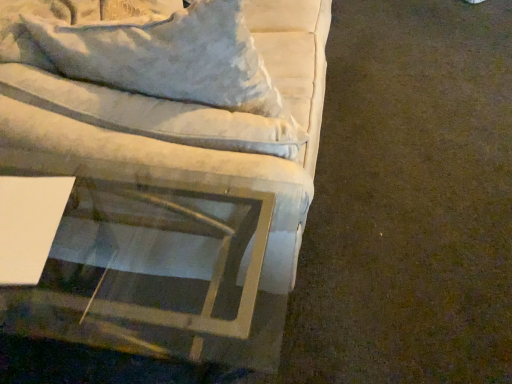
Question: Is velvet white couch at upper left bigger or smaller than clear glass table at lower left?

Choices:
 (A) big
 (B) small

Answer: (B)

Question: Is velvet white couch at upper left inside the boundaries of clear glass table at lower left, or outside?

Choices:
 (A) outside
 (B) inside

Answer: (A)

Question: Looking at their shapes, would you say velvet white couch at upper left is wider or thinner than clear glass table at lower left?

Choices:
 (A) wide
 (B) thin

Answer: (B)

Question: Based on their positions, is clear glass table at lower left located to the left or right of velvet white couch at upper left?

Choices:
 (A) left
 (B) right

Answer: (A)

Question: From the image's perspective, relative to velvet white couch at upper left, is clear glass table at lower left above or below?

Choices:
 (A) above
 (B) below

Answer: (B)

Question: Which is correct: clear glass table at lower left is inside velvet white couch at upper left, or outside of it?

Choices:
 (A) outside
 (B) inside

Answer: (A)

Question: Looking at the image, does clear glass table at lower left seem bigger or smaller compared to velvet white couch at upper left?

Choices:
 (A) small
 (B) big

Answer: (B)